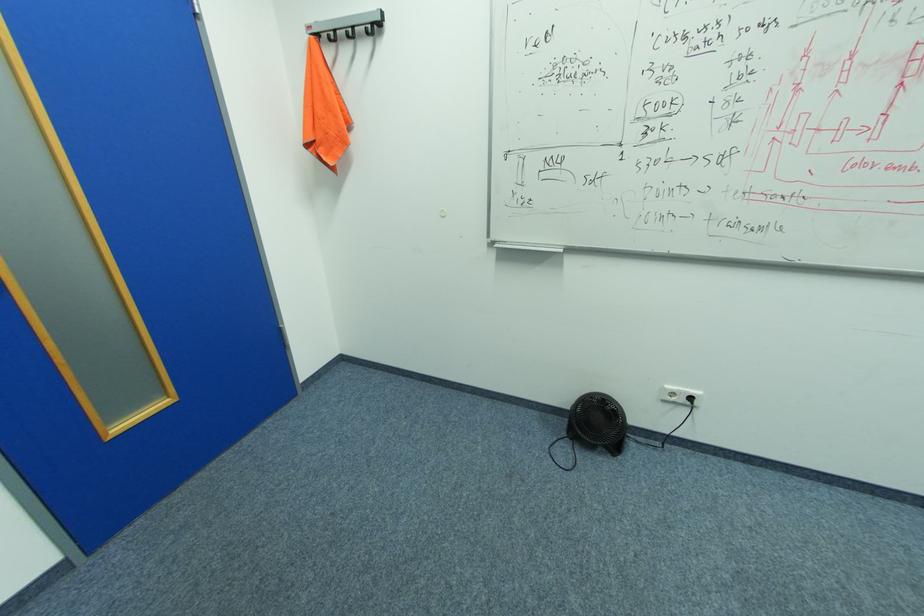
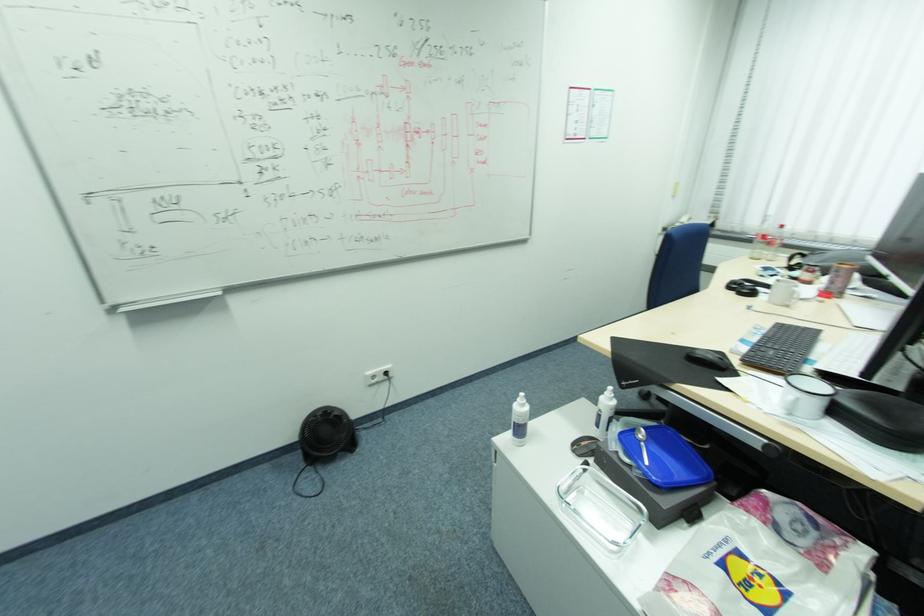
Question: I am providing you with two images of the same scene from different viewpoints. After the viewpoint changes to image2, which objects are now occluded?

Choices:
 (A) black computer mouse
 (B) white plastic bottle
 (C) glass food container
 (D) none of these

Answer: (D)